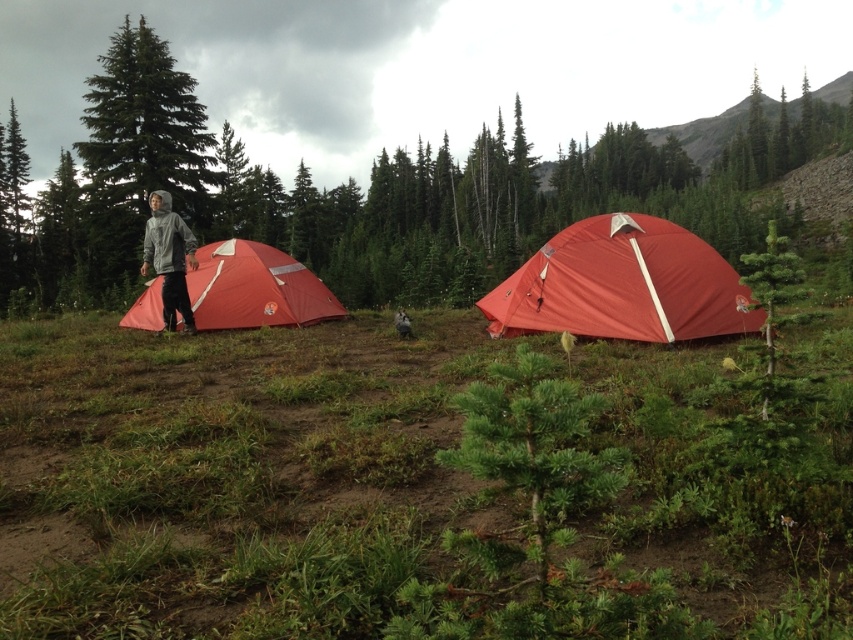
You are standing in the camping area and want to approach the two tents. Which tent, the matte red tent at center or the matte red tent at left, is closer to you?

The matte red tent at center is closer to you than the matte red tent at left.

You are a hiker who wants to set up a new tent in this camping area. You notice two existing tents labeled as the matte red tent at center and the matte red tent at left. Based on their positions, which tent is closer to the ground level?

The matte red tent at center is located below the matte red tent at left, so it is closer to the ground level than the other tent.

You are planning to set up a campfire in the camping scene. Considering the location of the matte red tent at center, where should you place the campfire to ensure it is at least 5 meters away from the tent? Use the coordinates provided to determine the safest spot.

The matte red tent at center is located at coordinates point (x=622, y=284). To place the campfire at least 5 meters away, you should position it outside the radius of 5 meters from these coordinates, ensuring it is a safe distance from the tent.